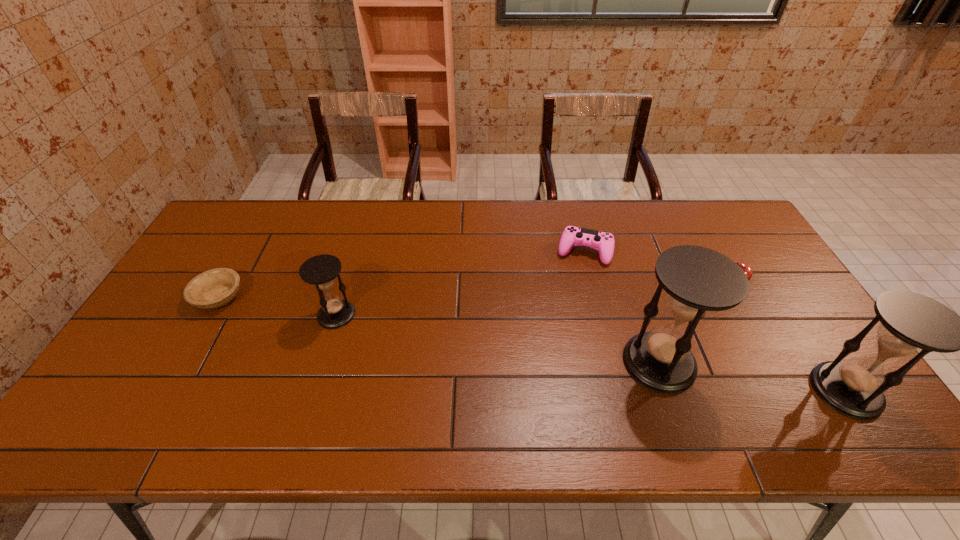
You are a GUI agent. You are given a task and a screenshot of the screen. Output one action in this format:
    pyautogui.click(x=<x>, y=<y>)
    Task: Click on the apple that is at the right edge
    This screenshot has height=540, width=960.
    Given the screenshot: What is the action you would take?
    pyautogui.click(x=746, y=268)

This screenshot has width=960, height=540. Identify the location of object located at the near right corner. (912, 324).

This screenshot has height=540, width=960. In the image, there is a desktop. Identify the location of free region at the far edge. (348, 215).

Find the location of a particular element. The height and width of the screenshot is (540, 960). free space at the near edge of the desktop is located at coordinates (276, 375).

Image resolution: width=960 pixels, height=540 pixels. In the image, there is a desktop. What are the coordinates of `free region at the left edge` in the screenshot? It's located at (229, 267).

I want to click on free space at the far right corner, so click(x=684, y=199).

Image resolution: width=960 pixels, height=540 pixels. In order to click on free space between the rightmost object and the second hourglass from right to left in this screenshot , I will do point(753,376).

Where is `unoccupied position between the farthest hourglass and the second hourglass from right to left`? unoccupied position between the farthest hourglass and the second hourglass from right to left is located at coordinates (497, 339).

What are the coordinates of `unoccupied position between the rightmost hourglass and the second hourglass from left to right` in the screenshot? It's located at (753, 376).

At what (x,y) coordinates should I click in order to perform the action: click on free spot between the second object from left to right and the second hourglass from left to right. Please return your answer as a coordinate pair (x, y). Looking at the image, I should click on (497, 339).